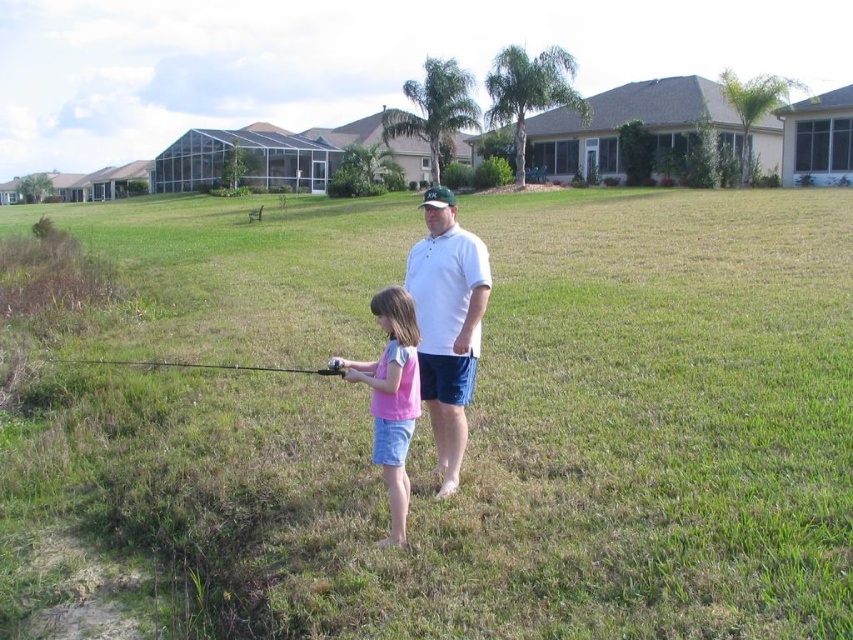
Which is behind, point (239, 336) or point (445, 484)?

The point (239, 336) is more distant.

Which is below, green grassy field at center or white cotton shirt at center?

white cotton shirt at center is below.

This screenshot has height=640, width=853. What are the coordinates of `green grassy field at center` in the screenshot? It's located at [x=527, y=444].

Where is `green grassy field at center`? The image size is (853, 640). green grassy field at center is located at coordinates (527, 444).

Who is lower down, white cotton shirt at center or black matte fishing pole at lower center?

black matte fishing pole at lower center is lower down.

Is white cotton shirt at center further to the viewer compared to black matte fishing pole at lower center?

No, white cotton shirt at center is in front of black matte fishing pole at lower center.

Is point (456, 468) positioned before point (202, 364)?

Yes, it is in front of point (202, 364).

In order to click on white cotton shirt at center in this screenshot , I will do `click(447, 323)`.

Can you confirm if white cotton shirt at center is bigger than pink cotton shirt at center?

Correct, white cotton shirt at center is larger in size than pink cotton shirt at center.

Can you confirm if white cotton shirt at center is wider than pink cotton shirt at center?

Yes.

This screenshot has width=853, height=640. I want to click on white cotton shirt at center, so click(447, 323).

Image resolution: width=853 pixels, height=640 pixels. I want to click on white cotton shirt at center, so click(447, 323).